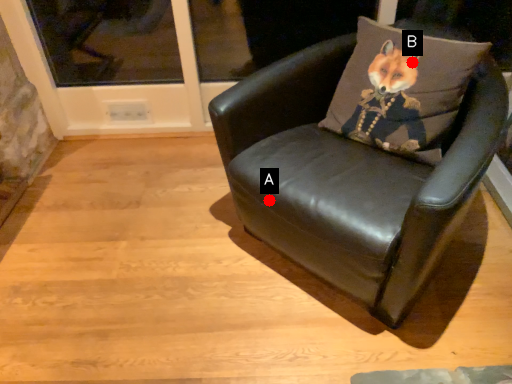
Question: Two points are circled on the image, labeled by A and B beside each circle. Which of the following is the farthest from the observer?

Choices:
 (A) A is further
 (B) B is further

Answer: (A)